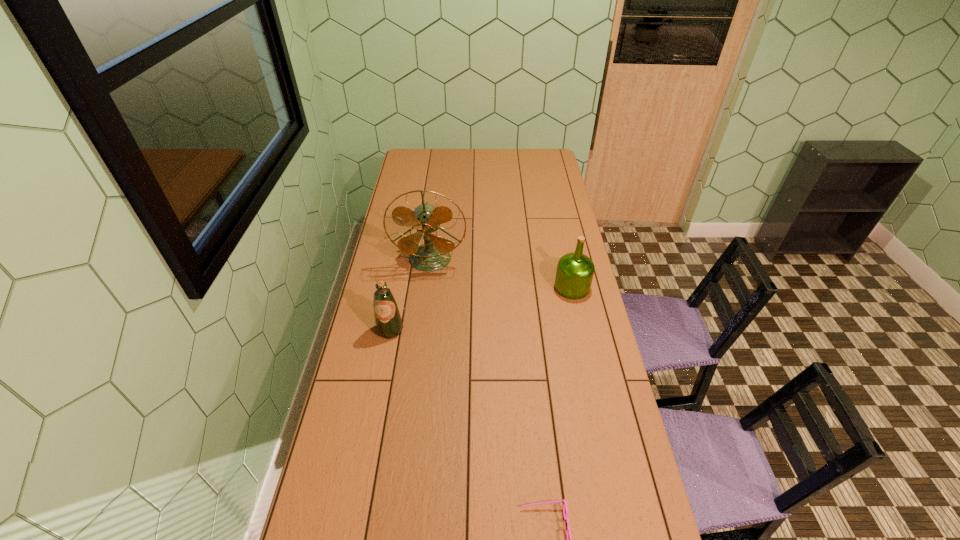
You are a GUI agent. You are given a task and a screenshot of the screen. Output one action in this format:
    pyautogui.click(x=<x>, y=<y>)
    Task: Click on the vacant area that lies between the fan and the rightmost object
    This screenshot has height=540, width=960.
    Given the screenshot: What is the action you would take?
    pyautogui.click(x=501, y=273)

This screenshot has width=960, height=540. In order to click on free space between the rightmost object and the fan in this screenshot , I will do `click(501, 273)`.

Where is `vacant region between the right olive oil and the nearer olive oil`? This screenshot has width=960, height=540. vacant region between the right olive oil and the nearer olive oil is located at coordinates (481, 308).

Locate which object ranks in proximity to the tallest object. Please provide its 2D coordinates. Your answer should be formatted as a tuple, i.e. [(x, y)], where the tuple contains the x and y coordinates of a point satisfying the conditions above.

[(388, 322)]

Where is `the second closest object to the tallest object`? the second closest object to the tallest object is located at coordinates (574, 274).

The image size is (960, 540). In order to click on vacant space that satisfies the following two spatial constraints: 1. in front of the right olive oil, directing air flow; 2. on the right side of the fan in this screenshot , I will do coord(426,287).